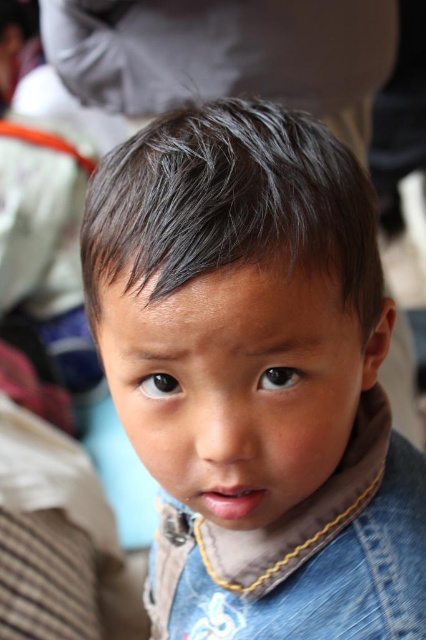
Is brown fuzzy hair at center to the right of dark brown hair at center from the viewer's perspective?

Yes, brown fuzzy hair at center is to the right of dark brown hair at center.

Which is more to the right, brown fuzzy hair at center or dark brown hair at center?

brown fuzzy hair at center is more to the right.

Between point (313, 448) and point (351, 186), which one is positioned in front?

Point (313, 448) is more forward.

At what (x,y) coordinates should I click in order to perform the action: click on brown fuzzy hair at center. Please return your answer as a coordinate pair (x, y). Looking at the image, I should click on [256, 378].

Does brown fuzzy hair at center appear on the left side of denim jacket at lower right?

No, brown fuzzy hair at center is not to the left of denim jacket at lower right.

Is point (226, 413) positioned after point (345, 608)?

No, (226, 413) is in front of (345, 608).

This screenshot has width=426, height=640. Find the location of `brown fuzzy hair at center`. brown fuzzy hair at center is located at coordinates (256, 378).

Who is lower down, dark brown hair at center or denim jacket at lower right?

denim jacket at lower right is lower down.

Which of these two, dark brown hair at center or denim jacket at lower right, stands shorter?

dark brown hair at center

This screenshot has width=426, height=640. I want to click on dark brown hair at center, so tap(230, 204).

Identify the location of dark brown hair at center. (230, 204).